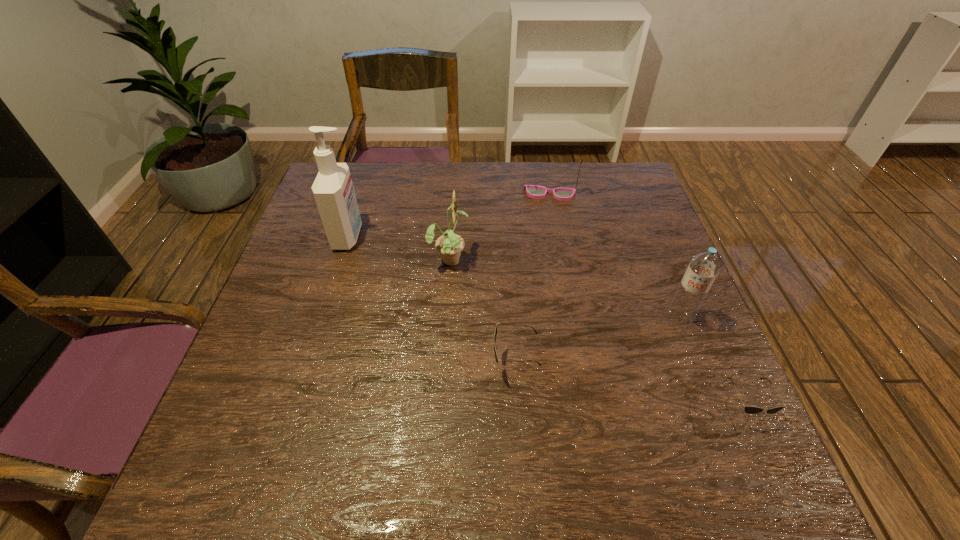
The image size is (960, 540). Identify the location of vacant space located in front of the lenses of the taller sunglasses. (345, 364).

Identify the location of free space located in front of the lenses of the taller sunglasses. (443, 364).

Locate an element on the screen. Image resolution: width=960 pixels, height=540 pixels. free location located 0.120m in front of the lenses of the taller sunglasses is located at coordinates (432, 364).

This screenshot has width=960, height=540. I want to click on vacant region located on the left of the fourth object from left to right, so click(425, 194).

Identify the location of vacant position located 0.130m on the front-facing side of the fifth object from right to left. (520, 259).

The image size is (960, 540). Find the location of `vacant space located 0.210m on the front of the water bottle`. vacant space located 0.210m on the front of the water bottle is located at coordinates (719, 419).

Identify the location of vacant space positioned 0.300m on the front label of the leftmost object. (475, 237).

Identify the location of object that is at the far edge. (534, 191).

At what (x,y) coordinates should I click in order to perform the action: click on object at the left edge. Please return your answer as a coordinate pair (x, y). Image resolution: width=960 pixels, height=540 pixels. Looking at the image, I should click on (333, 190).

Where is `sunglasses that is at the right edge`? The height and width of the screenshot is (540, 960). sunglasses that is at the right edge is located at coordinates (748, 409).